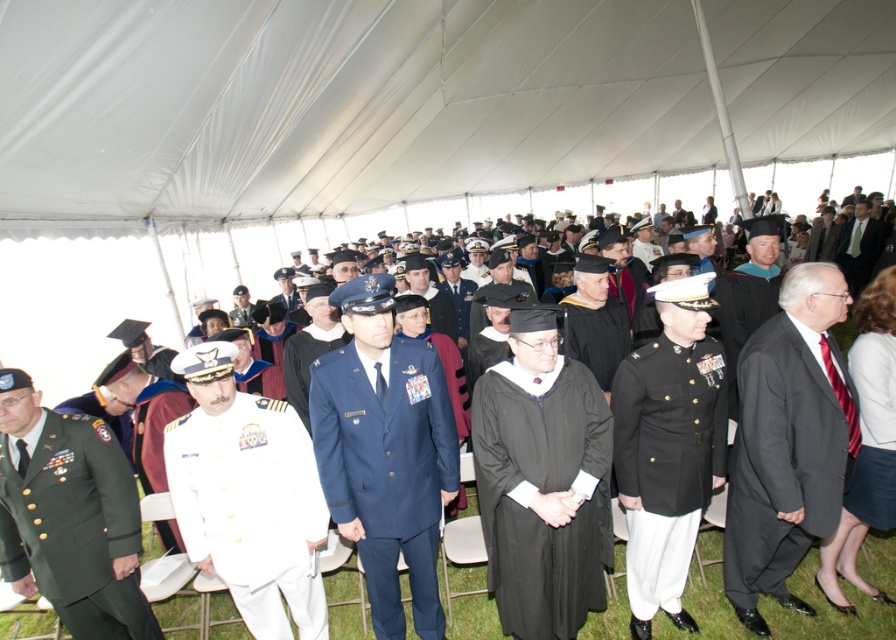
Between point (264, 433) and point (877, 582), which one is positioned behind?

The point (877, 582) is more distant.

Is point (291, 579) closer to viewer compared to point (694, 609)?

Yes, point (291, 579) is in front of point (694, 609).

You are a GUI agent. You are given a task and a screenshot of the screen. Output one action in this format:
    pyautogui.click(x=<x>, y=<y>)
    Task: Click on the white matte uniform at center
    The width and height of the screenshot is (896, 640).
    Given the screenshot: What is the action you would take?
    pyautogui.click(x=251, y=508)

Where is `white matte uniform at center`? The image size is (896, 640). white matte uniform at center is located at coordinates (251, 508).

Between black matte graduation gown at center and green military uniform at center, which one is positioned lower?

black matte graduation gown at center is below.

In the scene shown: Does black matte graduation gown at center have a larger size compared to green military uniform at center?

No, black matte graduation gown at center is not bigger than green military uniform at center.

You are a GUI agent. You are given a task and a screenshot of the screen. Output one action in this format:
    pyautogui.click(x=<x>, y=<y>)
    Task: Click on the black matte graduation gown at center
    Image resolution: width=896 pixels, height=640 pixels.
    Given the screenshot: What is the action you would take?
    pyautogui.click(x=543, y=492)

Can you confirm if white matte uniform at center is positioned below black matte military uniform at center?

Indeed, white matte uniform at center is positioned under black matte military uniform at center.

Is point (239, 499) more distant than point (711, 458)?

That is False.

In order to click on white matte uniform at center in this screenshot , I will do `click(251, 508)`.